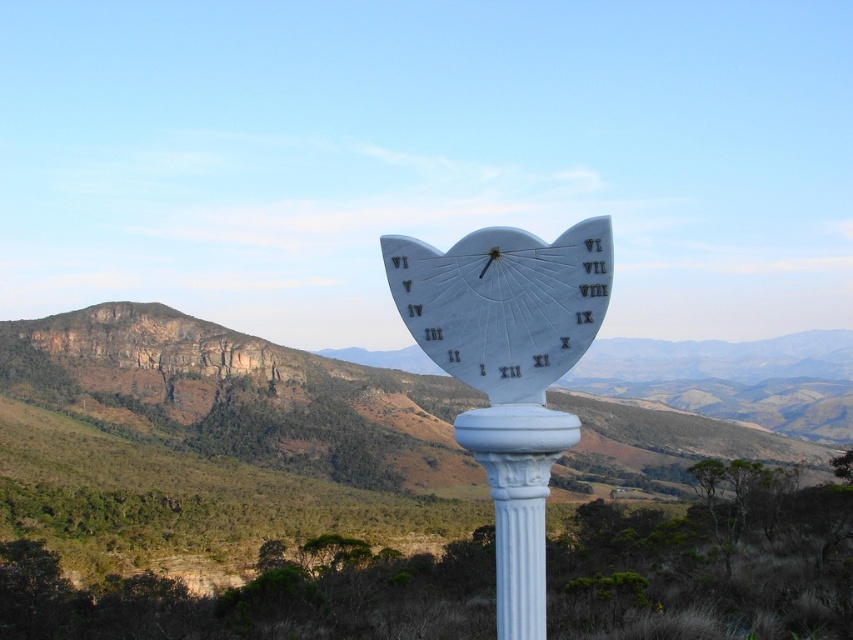
Is white glossy heart at center wider than white marble pillar at center?

Correct, the width of white glossy heart at center exceeds that of white marble pillar at center.

Is point (473, 378) farther from camera compared to point (503, 483)?

Yes, it is behind point (503, 483).

Measure the distance between point [450,317] and camera.

Point [450,317] and camera are 55.49 feet apart from each other.

Find the location of a particular element. The width and height of the screenshot is (853, 640). white glossy heart at center is located at coordinates (503, 304).

Between matte white sundial at center and white glossy heart at center, which one appears on the right side from the viewer's perspective?

Positioned to the right is white glossy heart at center.

Between matte white sundial at center and white glossy heart at center, which one appears on the left side from the viewer's perspective?

From the viewer's perspective, matte white sundial at center appears more on the left side.

The width and height of the screenshot is (853, 640). Describe the element at coordinates (229, 488) in the screenshot. I see `matte white sundial at center` at that location.

Where is `matte white sundial at center`? matte white sundial at center is located at coordinates (x=229, y=488).

Does white stone sundial at center have a smaller size compared to white glossy heart at center?

No, white stone sundial at center is not smaller than white glossy heart at center.

Is point (534, 412) farther from viewer compared to point (598, 241)?

Yes.

Does point (505, 355) lie in front of point (529, 397)?

No, it is behind (529, 397).

The image size is (853, 640). What are the coordinates of `white stone sundial at center` in the screenshot? It's located at (508, 371).